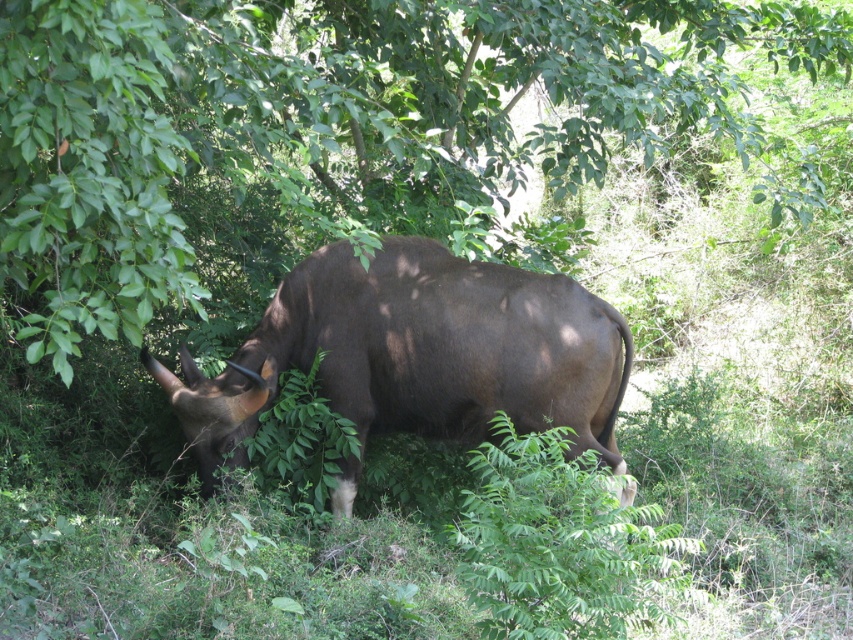
You are a wildlife photographer trying to capture a close shot of the brown matte bull at center without disturbing it. Your camera lens has a minimum focusing distance of 7 feet. Can you take the photo from your current position near the green leafy tree at center?

The green leafy tree at center is 6.85 feet from the brown matte bull at center. Since the distance is less than the camera lens minimum focusing distance of 7 feet, you can take the photo from your current position near the green leafy tree at center.

You are a wildlife photographer aiming to capture a clear photo of the brown matte bull at center. However, the green leafy tree at center is blocking your view. Can you determine if the tree is taller than the bull to decide whether to adjust your camera angle upwards or downwards?

The green leafy tree at center is not as tall as the brown matte bull at center, so you should adjust your camera angle downwards to avoid the tree and get a clear shot of the bull.

You are a photographer trying to capture a clear shot of the brown matte bull at center without the green leafy tree at center blocking the view. Based on the scene, can you position yourself in a way to avoid the tree obstructing the bull?

The green leafy tree at center is above the brown matte bull at center, so positioning yourself lower or moving to the side might allow you to capture the bull without the tree blocking the view.